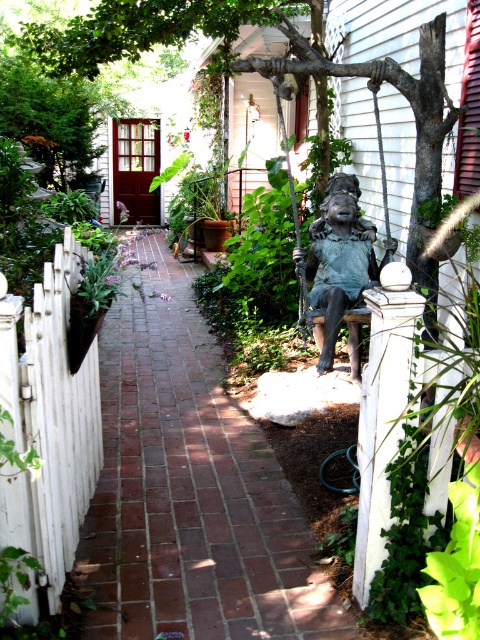
What do you see at coordinates (190, 488) in the screenshot? I see `brick at center` at bounding box center [190, 488].

Consider the image. Does brick at center have a larger size compared to white picket fence at left?

Actually, brick at center might be smaller than white picket fence at left.

Where is `brick at center`? The image size is (480, 640). brick at center is located at coordinates (190, 488).

Between point (1, 504) and point (332, 337), which one is positioned in front?

Positioned in front is point (1, 504).

Describe the element at coordinates (48, 428) in the screenshot. I see `white picket fence at left` at that location.

The height and width of the screenshot is (640, 480). I want to click on white picket fence at left, so click(x=48, y=428).

Which is in front, point (143, 556) or point (342, 253)?

Positioned in front is point (143, 556).

Can you confirm if brick at center is positioned to the left of bronze statue at center?

Yes, brick at center is to the left of bronze statue at center.

This screenshot has width=480, height=640. Describe the element at coordinates (190, 488) in the screenshot. I see `brick at center` at that location.

Where is `brick at center`? brick at center is located at coordinates (190, 488).